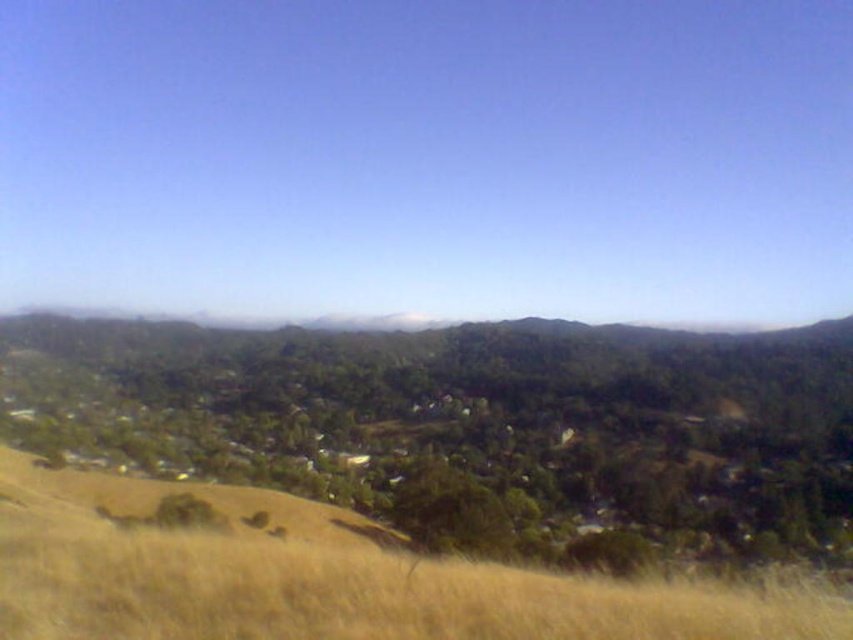
Question: Is dry grass at lower center smaller than white fluffy cloud at center?

Choices:
 (A) no
 (B) yes

Answer: (B)

Question: Does dry grass at lower center appear under white fluffy cloud at center?

Choices:
 (A) no
 (B) yes

Answer: (B)

Question: Which point appears closest to the camera in this image?

Choices:
 (A) (402, 324)
 (B) (447, 616)

Answer: (B)

Question: Is dry grass at lower center further to camera compared to white fluffy cloud at center?

Choices:
 (A) no
 (B) yes

Answer: (A)